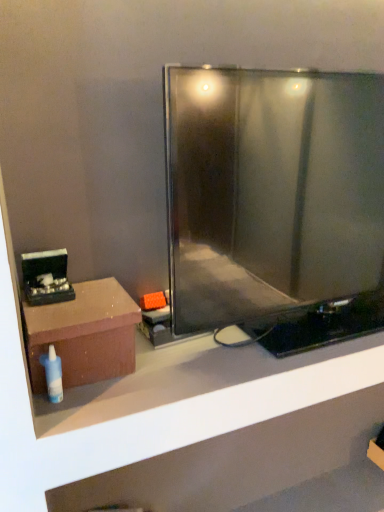
Find the location of a particular element. This screenshot has height=512, width=384. free spot in front of matte brown box at left is located at coordinates (91, 410).